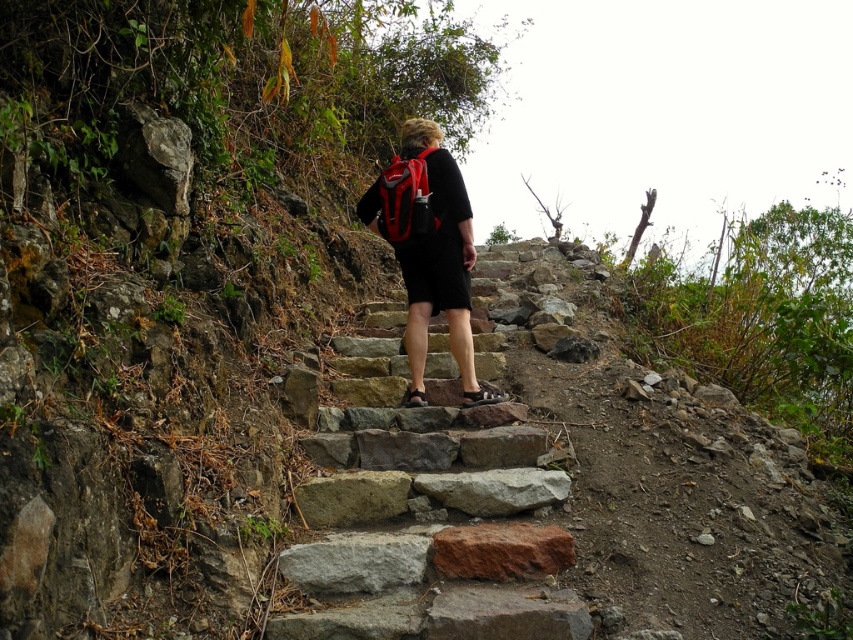
You are a hiker carrying a matte black backpack at center and standing on gray stone stairs at center. Can your backpack fit between the two adjacent steps of the stairs without touching them?

The gray stone stairs at center are wider than the matte black backpack at center, so the backpack can fit between the two adjacent steps without touching them.